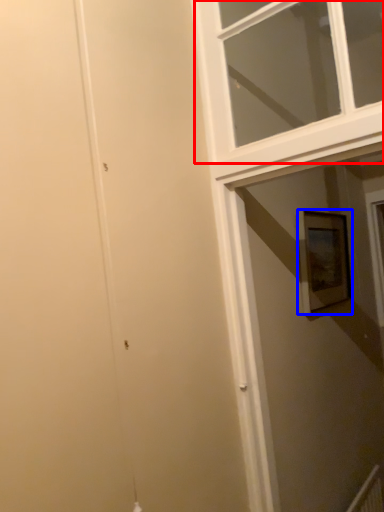
Question: Among these objects, which one is nearest to the camera, window (highlighted by a red box) or picture frame (highlighted by a blue box)?

Choices:
 (A) window
 (B) picture frame

Answer: (A)